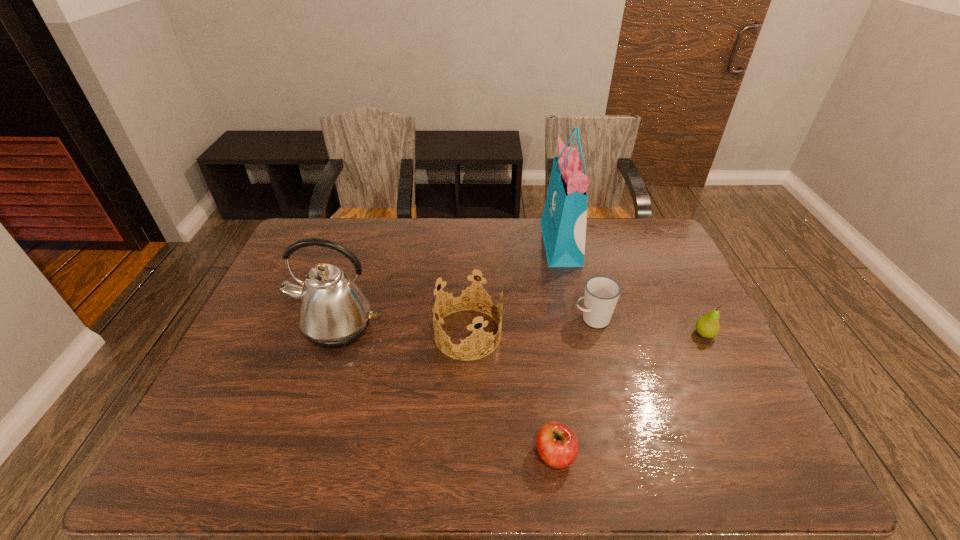
What are the coordinates of `object that is at the left edge` in the screenshot? It's located at (333, 312).

At what (x,y) coordinates should I click in order to perform the action: click on object positioned at the right edge. Please return your answer as a coordinate pair (x, y). The height and width of the screenshot is (540, 960). Looking at the image, I should click on (707, 326).

Identify the location of vacant area at the far edge. The image size is (960, 540). (482, 240).

You are a GUI agent. You are given a task and a screenshot of the screen. Output one action in this format:
    pyautogui.click(x=<x>, y=<y>)
    Task: Click on the vacant space at the near edge of the desktop
    
    Given the screenshot: What is the action you would take?
    pyautogui.click(x=372, y=469)

Identify the location of free space at the left edge of the desktop. The width and height of the screenshot is (960, 540). (258, 330).

This screenshot has width=960, height=540. In the image, there is a desktop. Find the location of `vacant space at the right edge`. vacant space at the right edge is located at coordinates (748, 399).

This screenshot has width=960, height=540. What are the coordinates of `vacant point at the near left corner` in the screenshot? It's located at (208, 455).

The width and height of the screenshot is (960, 540). What are the coordinates of `empty space between the fourth shortest object and the apple` in the screenshot? It's located at coord(512,394).

What are the coordinates of `free point between the rightmost object and the farthest object` in the screenshot? It's located at (633, 288).

This screenshot has height=540, width=960. I want to click on empty space that is in between the shortest object and the cup, so click(x=574, y=387).